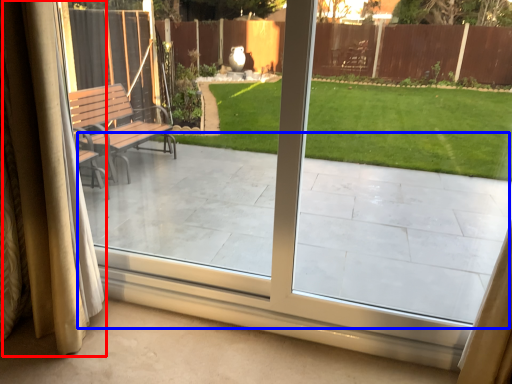
Question: Among these objects, which one is farthest to the camera, curtain (highlighted by a red box) or porch (highlighted by a blue box)?

Choices:
 (A) curtain
 (B) porch

Answer: (A)